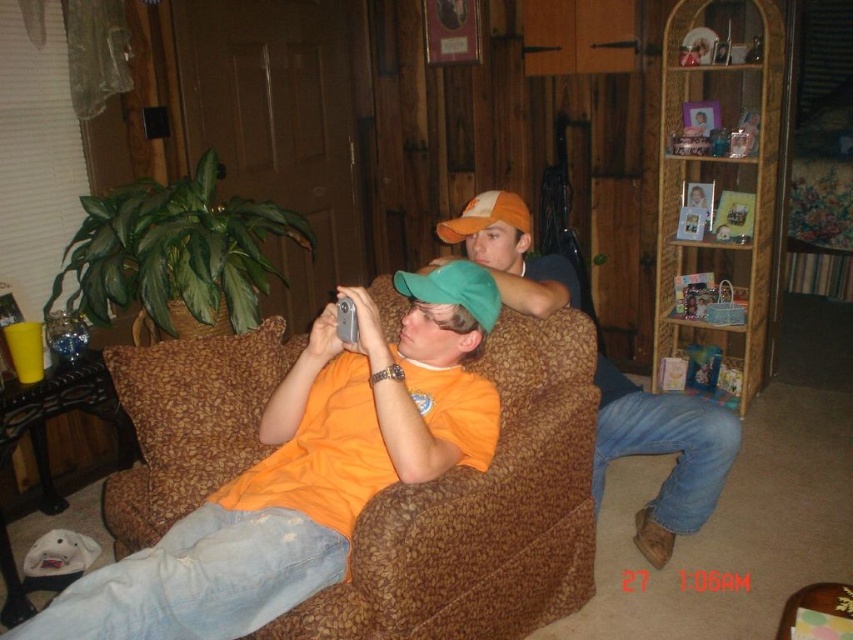
Question: Which object is positioned closest to the brown textured armchair at center?

Choices:
 (A) orange cotton shirt at center
 (B) wooden bookshelf at upper right

Answer: (A)

Question: Is wooden bookshelf at upper right thinner than orange cotton shirt at center?

Choices:
 (A) yes
 (B) no

Answer: (A)

Question: Can you confirm if brown textured armchair at center is bigger than orange cotton shirt at center?

Choices:
 (A) no
 (B) yes

Answer: (A)

Question: Which object is the closest to the brown textured armchair at center?

Choices:
 (A) wooden bookshelf at upper right
 (B) orange cotton shirt at center

Answer: (B)

Question: Does brown textured armchair at center have a lesser width compared to orange cotton shirt at center?

Choices:
 (A) no
 (B) yes

Answer: (B)

Question: Which point is closer to the camera?

Choices:
 (A) (665, 246)
 (B) (456, 614)

Answer: (B)